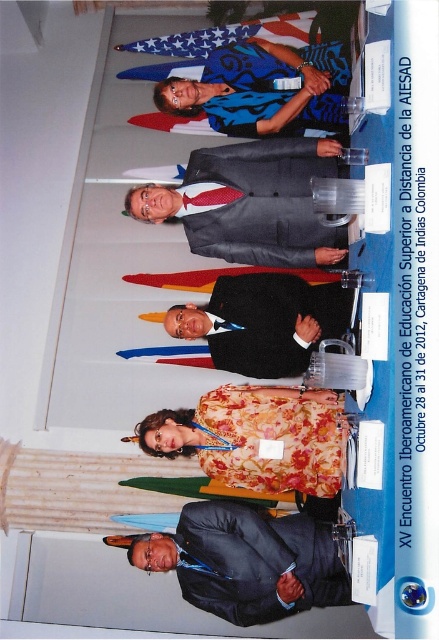
Does floral fabric blouse at center have a lesser width compared to shiny red tie at center?

No, floral fabric blouse at center is not thinner than shiny red tie at center.

Who is lower down, floral fabric blouse at center or shiny red tie at center?

floral fabric blouse at center is below.

Is point (277, 387) closer to viewer compared to point (243, 193)?

That is True.

Find the location of a particular element. floral fabric blouse at center is located at coordinates (255, 436).

Between white star-spangled banner at upper center and shiny red tie at center, which one is positioned higher?

white star-spangled banner at upper center is higher up.

Who is more forward, (207,29) or (197,202)?

Positioned in front is point (197,202).

What are the coordinates of `white star-spangled banner at upper center` in the screenshot? It's located at (226, 36).

Is dark gray suit at lower center smaller than floral fabric blouse at center?

Correct, dark gray suit at lower center occupies less space than floral fabric blouse at center.

Between point (259, 611) and point (305, 410), which one is positioned behind?

Point (305, 410)

Where is `dark gray suit at lower center`? This screenshot has height=640, width=439. dark gray suit at lower center is located at coordinates (244, 561).